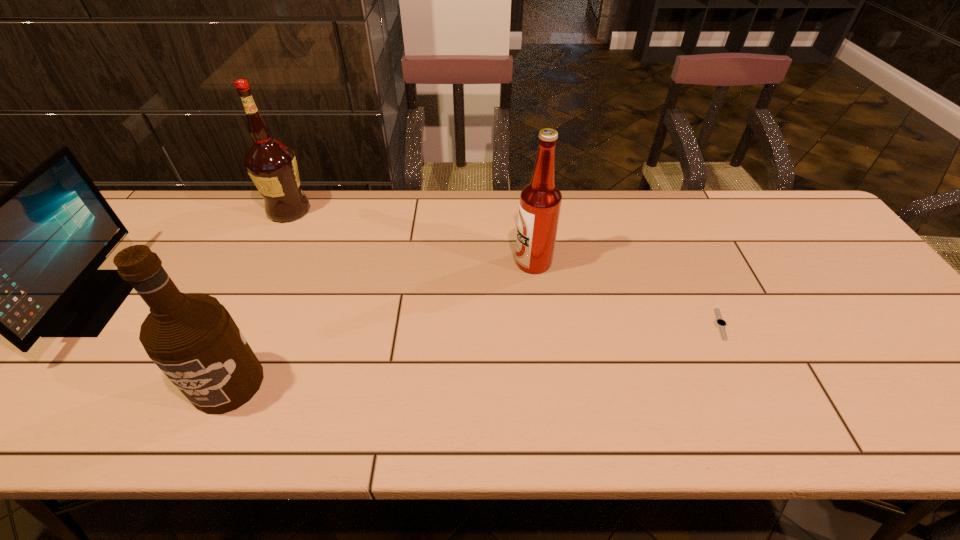
You are a GUI agent. You are given a task and a screenshot of the screen. Output one action in this format:
    pyautogui.click(x=<x>, y=<y>)
    Task: Click on the vacant space at the right edge of the desktop
    This screenshot has height=540, width=960.
    Given the screenshot: What is the action you would take?
    pyautogui.click(x=892, y=314)

The width and height of the screenshot is (960, 540). I want to click on vacant point at the far left corner, so click(x=197, y=211).

At what (x,y) coordinates should I click in order to perform the action: click on free space between the leftmost object and the farthest alcohol. Please return your answer as a coordinate pair (x, y). Looking at the image, I should click on (193, 256).

Locate an element on the screen. This screenshot has width=960, height=540. free spot between the rightmost alcohol and the nearest alcohol is located at coordinates (381, 323).

I want to click on vacant area between the farthest object and the second nearest alcohol, so click(411, 236).

What are the coordinates of `vacant point located between the farthest alcohol and the leftmost object` in the screenshot? It's located at (193, 256).

Where is `free point between the nearest alcohol and the fourth object from left to right`? This screenshot has width=960, height=540. free point between the nearest alcohol and the fourth object from left to right is located at coordinates (381, 323).

Identify which object is the second closest to the rightmost object. Please provide its 2D coordinates. Your answer should be formatted as a tuple, i.e. [(x, y)], where the tuple contains the x and y coordinates of a point satisfying the conditions above.

[(192, 338)]

Where is `object that is the fourth nearest to the fourth object from left to right`? object that is the fourth nearest to the fourth object from left to right is located at coordinates (24, 264).

Identify which alcohol is located as the second nearest to the leftmost object. Please provide its 2D coordinates. Your answer should be formatted as a tuple, i.e. [(x, y)], where the tuple contains the x and y coordinates of a point satisfying the conditions above.

[(192, 338)]